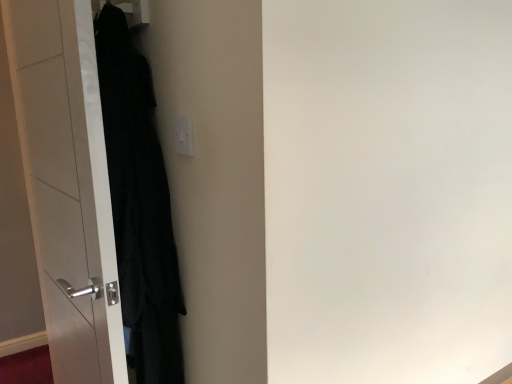
Image resolution: width=512 pixels, height=384 pixels. What do you see at coordinates (139, 206) in the screenshot?
I see `black matte coat at left` at bounding box center [139, 206].

This screenshot has height=384, width=512. Find the location of `white glossy door at left`. white glossy door at left is located at coordinates (67, 185).

Can you confirm if white plastic electric outlet at upper center is wider than white glossy door at left?

Incorrect, the width of white plastic electric outlet at upper center does not surpass that of white glossy door at left.

Consider the image. From the image's perspective, which one is positioned lower, white plastic electric outlet at upper center or white glossy door at left?

white glossy door at left appears lower in the image.

The width and height of the screenshot is (512, 384). Identify the location of electric outlet on the right of the white glossy door at left. (184, 135).

What's the angular difference between white plastic electric outlet at upper center and white glossy door at left's facing directions?

They differ by 8.39 degrees in their facing directions.

Which object is positioned more to the right, white glossy door at left or white plastic electric outlet at upper center?

white plastic electric outlet at upper center is more to the right.

Does white glossy door at left come behind white plastic electric outlet at upper center?

No, it is not.

Is white glossy door at left oriented towards white plastic electric outlet at upper center?

No.

Does point (58, 146) come in front of point (175, 138)?

No, (58, 146) is behind (175, 138).

Looking at this image, who is shorter, black matte coat at left or white glossy door at left?

black matte coat at left is shorter.

From the image's perspective, would you say black matte coat at left is shown under white glossy door at left?

Incorrect, from the image's perspective, black matte coat at left is higher than white glossy door at left.

How different are the orientations of black matte coat at left and white glossy door at left in degrees?

The angle between the facing direction of black matte coat at left and the facing direction of white glossy door at left is 0.00121 degrees.

Which of these two, black matte coat at left or white glossy door at left, is thinner?

white glossy door at left is thinner.

Based on their positions, is white glossy door at left located to the left or right of black matte coat at left?

white glossy door at left is positioned on black matte coat at left's left side.

How distant is white glossy door at left from black matte coat at left?

white glossy door at left is 8.56 inches away from black matte coat at left.

Are white glossy door at left and black matte coat at left far apart?

white glossy door at left is actually quite close to black matte coat at left.

From a real-world perspective, who is located lower, white glossy door at left or black matte coat at left?

In real-world perspective, white glossy door at left is lower.

Is white plastic electric outlet at upper center not inside black matte coat at left?

white plastic electric outlet at upper center lies outside black matte coat at left's area.

Is white plastic electric outlet at upper center turned away from black matte coat at left?

No.

Considering the relative positions of white plastic electric outlet at upper center and black matte coat at left in the image provided, is white plastic electric outlet at upper center to the left or to the right of black matte coat at left?

From the image, it's evident that white plastic electric outlet at upper center is to the right of black matte coat at left.

Considering their positions, is white plastic electric outlet at upper center located in front of or behind black matte coat at left?

white plastic electric outlet at upper center is behind black matte coat at left.

Is the depth of black matte coat at left less than that of white plastic electric outlet at upper center?

Yes, it is.

How many degrees apart are the facing directions of black matte coat at left and white plastic electric outlet at upper center?

The angle between the facing direction of black matte coat at left and the facing direction of white plastic electric outlet at upper center is 8.39 degrees.

Which object is thinner, black matte coat at left or white plastic electric outlet at upper center?

white plastic electric outlet at upper center.

Is point (123, 88) positioned before point (179, 138)?

No, (123, 88) is further to viewer.

You are a GUI agent. You are given a task and a screenshot of the screen. Output one action in this format:
    pyautogui.click(x=<x>, y=<y>)
    Task: Click on the door below the white plastic electric outlet at upper center (from the image's perspective)
    This screenshot has height=384, width=512.
    Given the screenshot: What is the action you would take?
    point(67,185)

At what (x,y) coordinates should I click in order to perform the action: click on electric outlet behind the white glossy door at left. Please return your answer as a coordinate pair (x, y). Looking at the image, I should click on (184, 135).

When comparing their distances from black matte coat at left, does white glossy door at left or white plastic electric outlet at upper center seem closer?

Based on the image, white glossy door at left appears to be nearer to black matte coat at left.

Estimate the real-world distances between objects in this image. Which object is further from white plastic electric outlet at upper center, white glossy door at left or black matte coat at left?

white glossy door at left is positioned further to the anchor white plastic electric outlet at upper center.

Estimate the real-world distances between objects in this image. Which object is closer to white glossy door at left, black matte coat at left or white plastic electric outlet at upper center?

Based on the image, black matte coat at left appears to be nearer to white glossy door at left.

From the image, which object appears to be nearer to white glossy door at left, white plastic electric outlet at upper center or black matte coat at left?

black matte coat at left is closer to white glossy door at left.

Which object lies nearer to the anchor point white plastic electric outlet at upper center, black matte coat at left or white glossy door at left?

The object closer to white plastic electric outlet at upper center is black matte coat at left.

From the picture: Estimate the real-world distances between objects in this image. Which object is further from black matte coat at left, white plastic electric outlet at upper center or white glossy door at left?

Based on the image, white plastic electric outlet at upper center appears to be further to black matte coat at left.

Where is `clothing located between white glossy door at left and white plastic electric outlet at upper center in the left-right direction`? clothing located between white glossy door at left and white plastic electric outlet at upper center in the left-right direction is located at coordinates (139, 206).